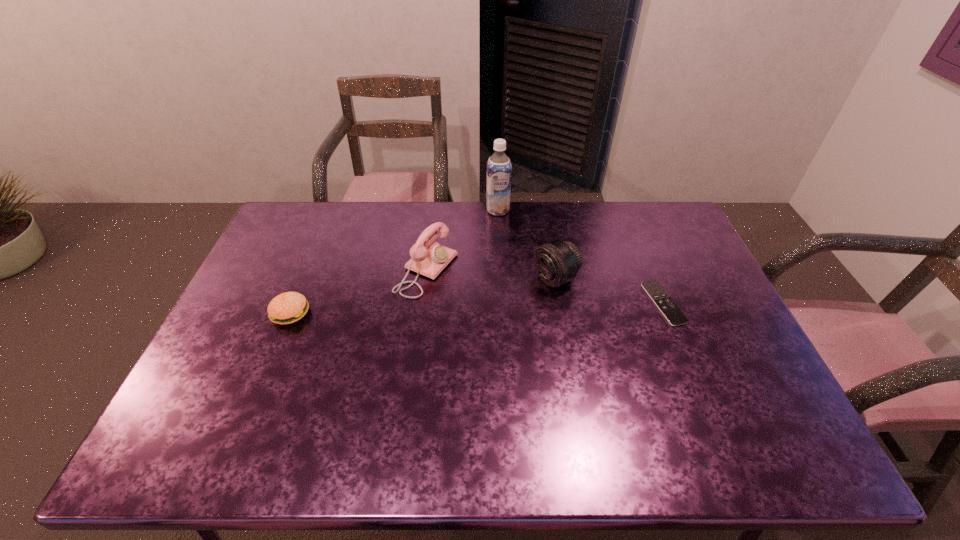
Find the location of `free space on the desktop that is between the patty and the shortest object and is positioned on the label of the soya milk`. free space on the desktop that is between the patty and the shortest object and is positioned on the label of the soya milk is located at coordinates (513, 307).

I want to click on vacant space on the desktop that is between the fourth tallest object and the rightmost object and is positioned on the front-facing side of the fourth object from left to right, so click(x=498, y=308).

Where is `vacant space on the desktop that is between the patty and the rightmost object and is positioned on the dial of the telephone`? The image size is (960, 540). vacant space on the desktop that is between the patty and the rightmost object and is positioned on the dial of the telephone is located at coordinates (519, 307).